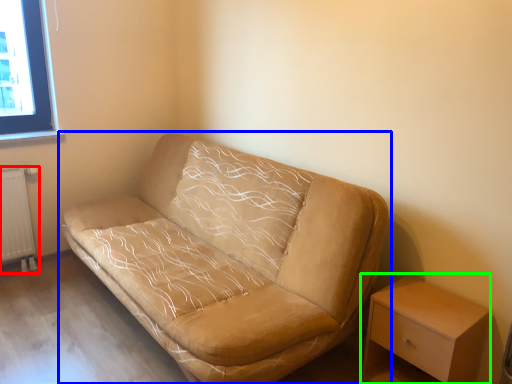
Question: Estimate the real-world distances between objects in this image. Which object is farther from radiator (highlighted by a red box), studio couch (highlighted by a blue box) or table (highlighted by a green box)?

Choices:
 (A) studio couch
 (B) table

Answer: (B)